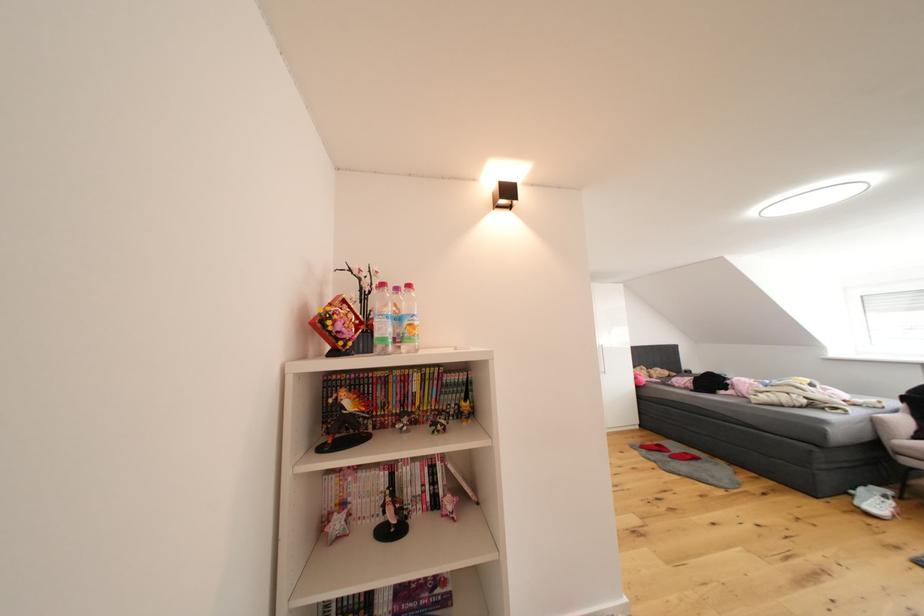
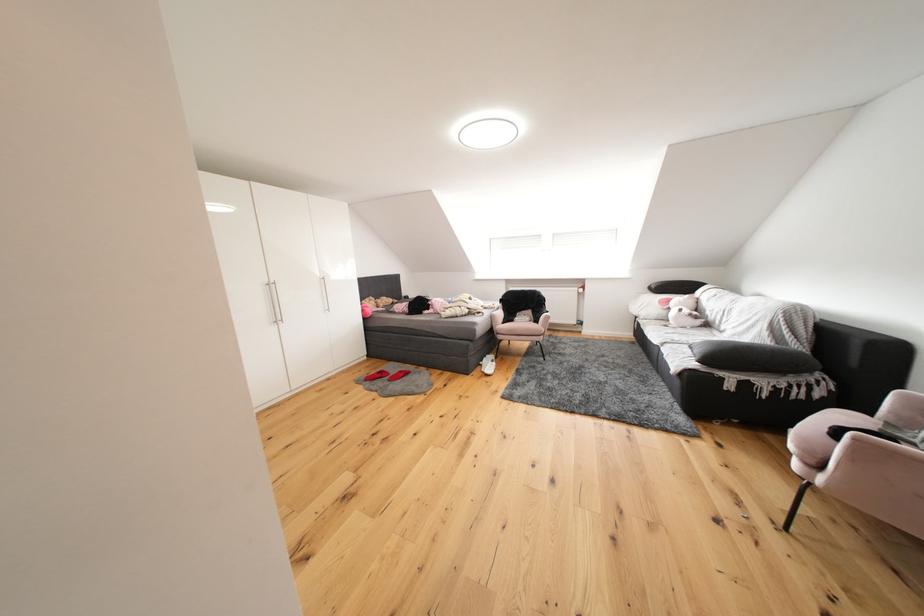
Question: I am providing you with two images of the same scene from different viewpoints. Which of the following objects are not visible in image2?

Choices:
 (A) silver wardrobe handle
 (B) black pillow
 (C) red slipper
 (D) none of these

Answer: (D)